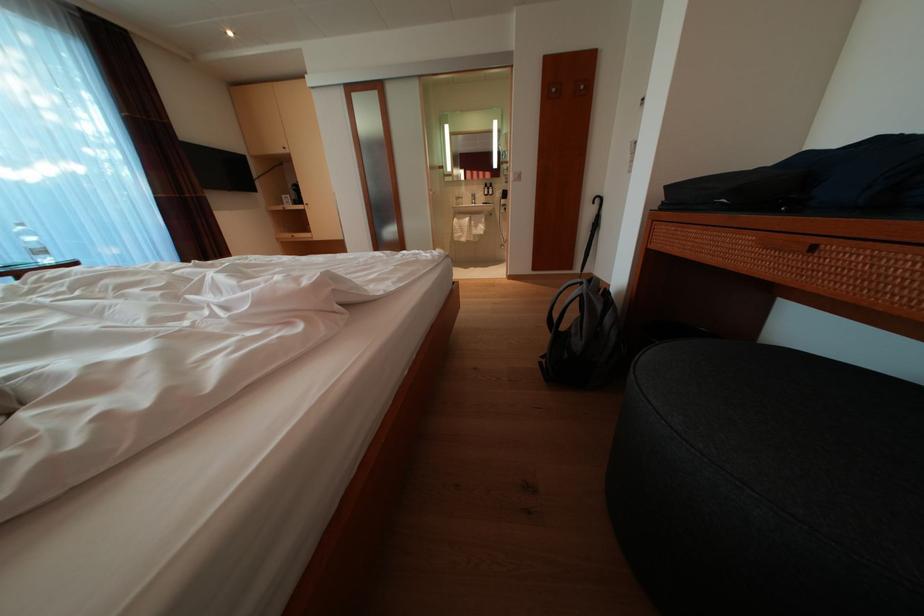
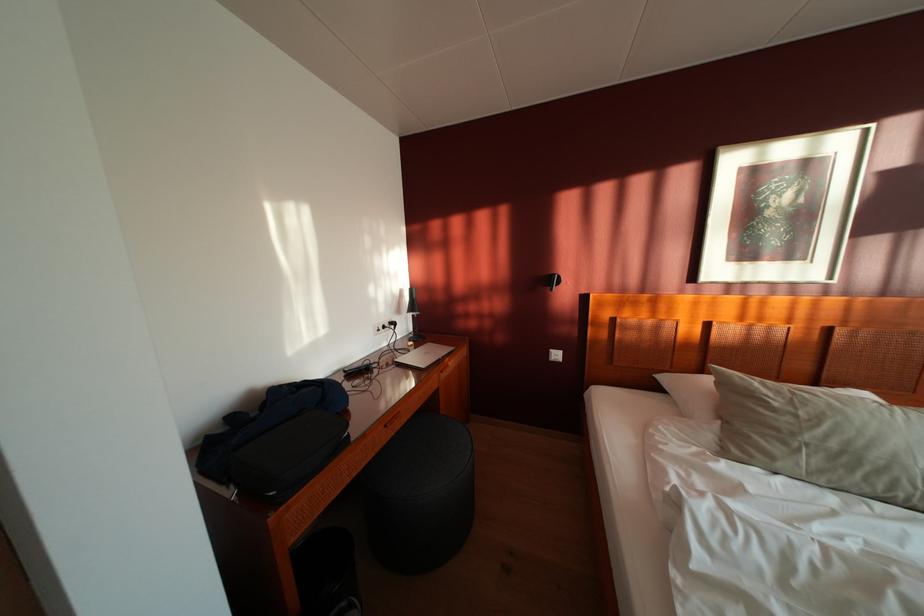
Question: I am providing you with two images of the same scene from different viewpoints. Please identify which objects are invisible in image2.

Choices:
 (A) black travel case
 (B) black desk lamp
 (C) black stool
 (D) none of these

Answer: (D)